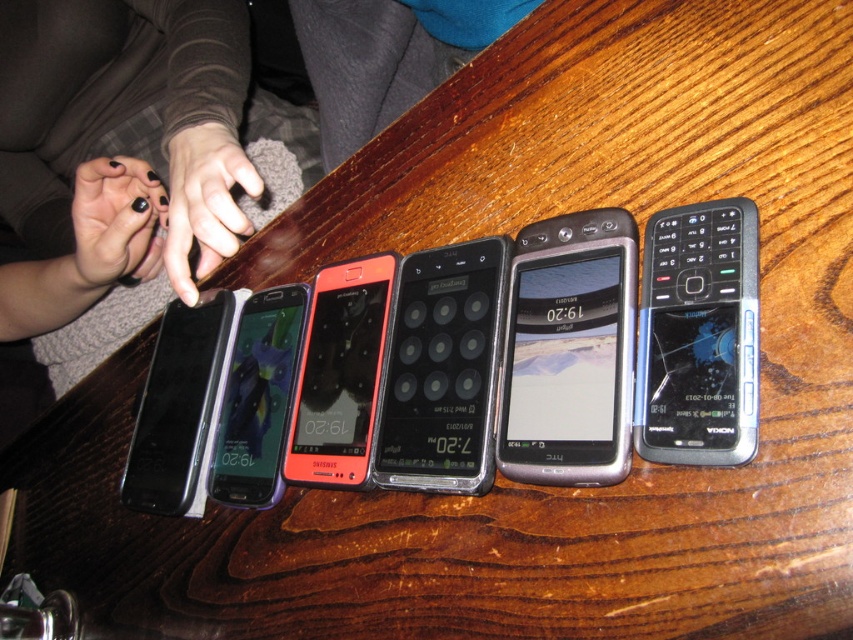
Between point (274, 403) and point (102, 202), which one is positioned behind?

Point (102, 202)

Which is in front, point (241, 432) or point (135, 212)?

Positioned in front is point (241, 432).

Identify the location of matte black smartphone at center. (257, 397).

Consider the image. Between matte black phone at center and black matte nail polish at left, which one appears on the right side from the viewer's perspective?

matte black phone at center is more to the right.

Who is more forward, (x=363, y=403) or (x=224, y=125)?

Point (x=363, y=403) is in front.

Locate an element on the screen. matte black phone at center is located at coordinates (340, 372).

Is black plastic nokia phone at right smaller than black glossy smartphone at left?

Correct, black plastic nokia phone at right occupies less space than black glossy smartphone at left.

Who is shorter, black plastic nokia phone at right or black glossy smartphone at left?

black plastic nokia phone at right

Between point (711, 218) and point (171, 340), which one is positioned in front?

Point (711, 218) is more forward.

Find the location of a particular element. black plastic nokia phone at right is located at coordinates (698, 336).